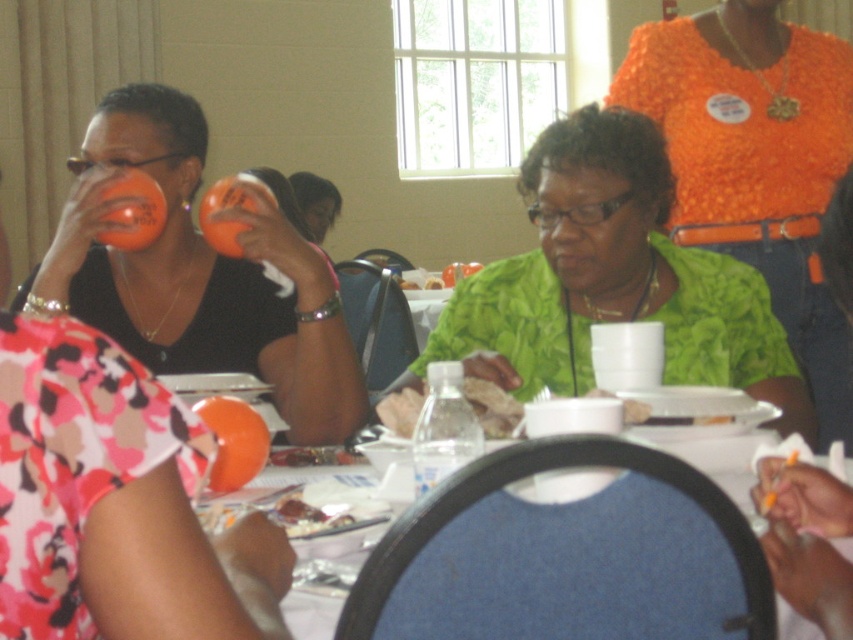
You are a server at a restaurant and need to place a 6.5 inch wide platter between the blue fabric chair at lower center and the clear plastic bottle at center. Can you fit it there?

The distance between the blue fabric chair at lower center and the clear plastic bottle at center is 6.61 inches, so the 6.5 inch wide platter can fit in that space.

You are a photographer trying to capture a closeup of the clear plastic bottle at center. Given that your camera requires the subject to be at least 5 feet away to avoid distortion, is the current distance sufficient?

The clear plastic bottle at center is only 4.10 feet away from the camera, which is less than the required 5 feet. Therefore, the current distance is insufficient to avoid distortion.